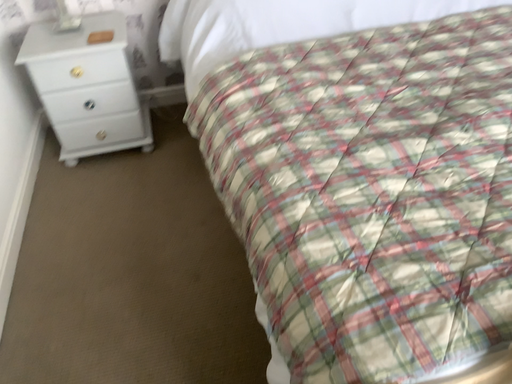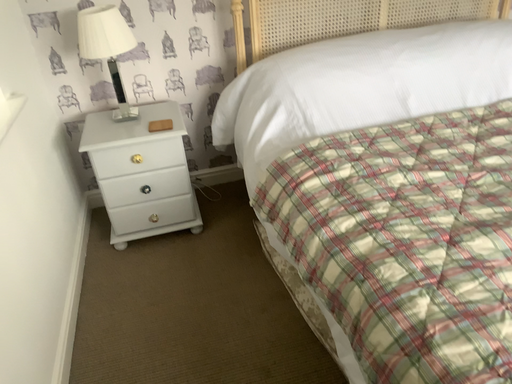
Question: Which way did the camera rotate in the video?

Choices:
 (A) rotated upward
 (B) rotated downward

Answer: (A)